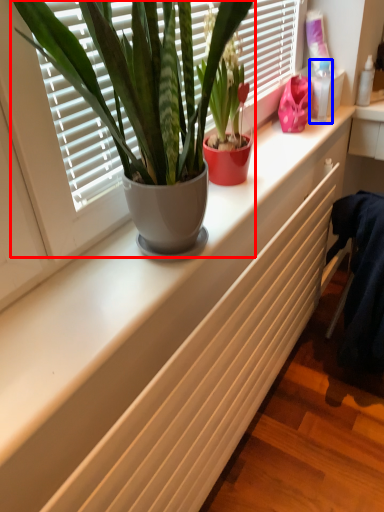
Question: Which object is further to the camera taking this photo, houseplant (highlighted by a red box) or toiletry (highlighted by a blue box)?

Choices:
 (A) houseplant
 (B) toiletry

Answer: (B)